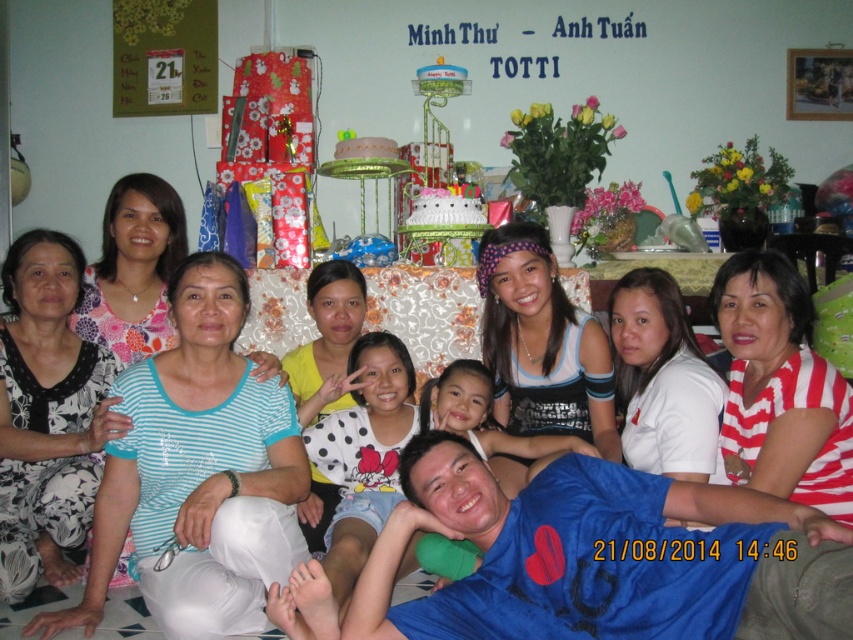
You are a photographer trying to adjust the seating arrangement so that everyone is visible in the photo. The blue cotton shirt at lower center and the white striped shirt at center are currently blocking each other. Which shirt should be moved higher to ensure both are visible?

The blue cotton shirt at lower center should be moved higher because it is shorter than the white striped shirt at center, so raising it would prevent blocking.